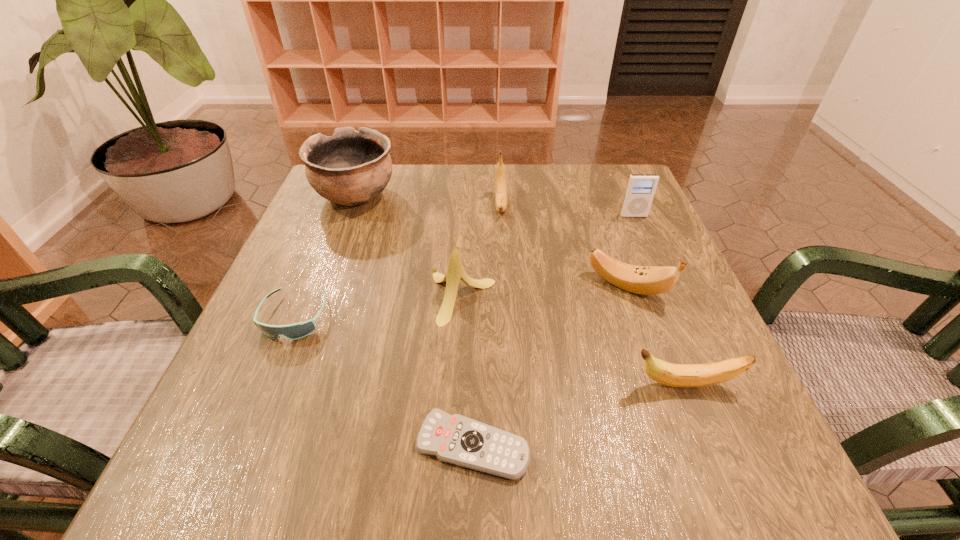
Locate an element on the screen. Image resolution: width=960 pixels, height=540 pixels. pottery is located at coordinates (349, 168).

I want to click on the farthest banana, so click(x=501, y=201).

The height and width of the screenshot is (540, 960). Identify the location of the leftmost banana. (455, 272).

The width and height of the screenshot is (960, 540). Find the location of `iPod`. iPod is located at coordinates (641, 188).

Where is `the third tallest banana`? Image resolution: width=960 pixels, height=540 pixels. the third tallest banana is located at coordinates (647, 280).

Identify the location of the seventh farthest object. (674, 375).

Image resolution: width=960 pixels, height=540 pixels. In order to click on the third shortest object in this screenshot , I will do `click(674, 375)`.

Find the location of a particular element. The width and height of the screenshot is (960, 540). goggles is located at coordinates [299, 330].

Identify the location of remote control. (456, 439).

This screenshot has height=540, width=960. What are the coordinates of `the shortest object` in the screenshot? It's located at (456, 439).